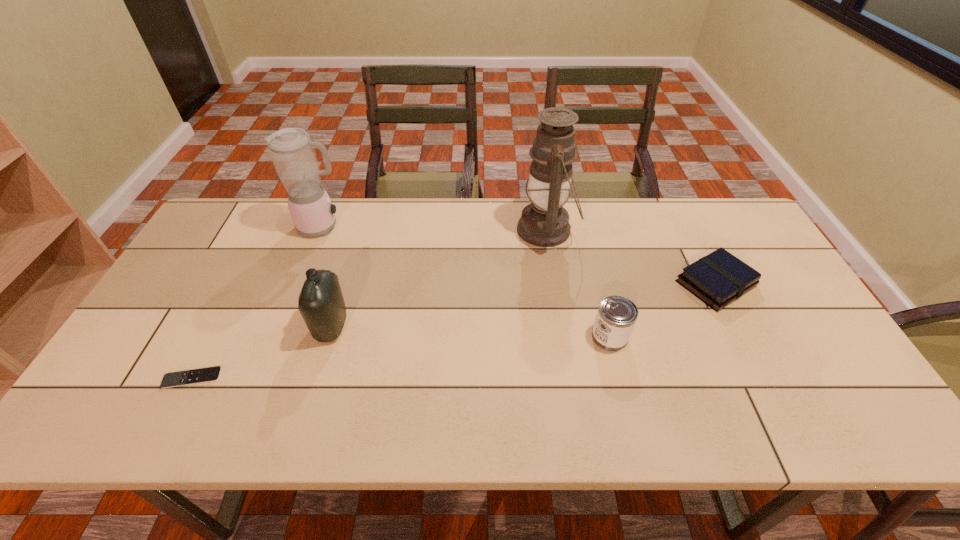
The image size is (960, 540). Find the location of `the tallest object`. the tallest object is located at coordinates coord(544,222).

Find the location of `food processor`. food processor is located at coordinates (292, 151).

At what (x,y) coordinates should I click in order to perform the action: click on the fifth shortest object. Please return your answer as a coordinate pair (x, y). Image resolution: width=960 pixels, height=540 pixels. Looking at the image, I should click on (292, 151).

Where is `bottle`? The height and width of the screenshot is (540, 960). bottle is located at coordinates (321, 304).

Where is `the fourth object from right to left`? The image size is (960, 540). the fourth object from right to left is located at coordinates (321, 304).

Where is `the third shortest object`? the third shortest object is located at coordinates [x=617, y=315].

This screenshot has height=540, width=960. What are the coordinates of `book` in the screenshot? It's located at (719, 278).

The height and width of the screenshot is (540, 960). In order to click on the rightmost object in this screenshot , I will do `click(719, 278)`.

At what (x,y) coordinates should I click in order to perform the action: click on remote control. Please return your answer as a coordinate pair (x, y). Looking at the image, I should click on (181, 378).

Find the location of `the nearest object`. the nearest object is located at coordinates (181, 378).